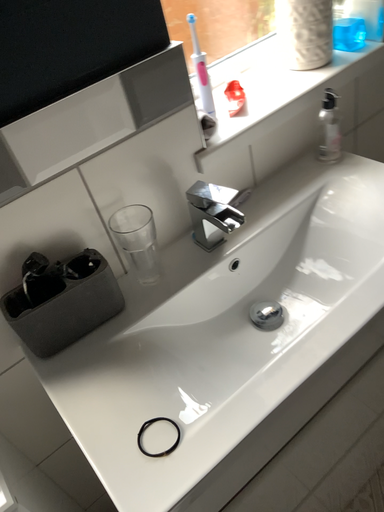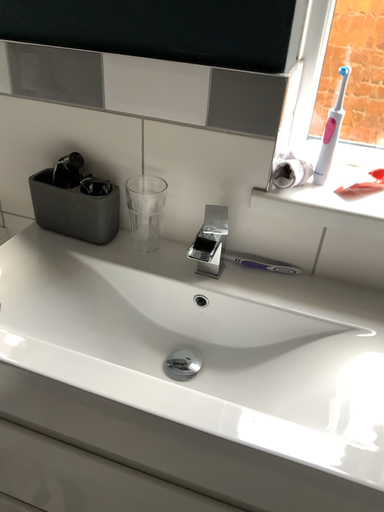
Question: Which way did the camera rotate in the video?

Choices:
 (A) rotated left
 (B) rotated right

Answer: (A)